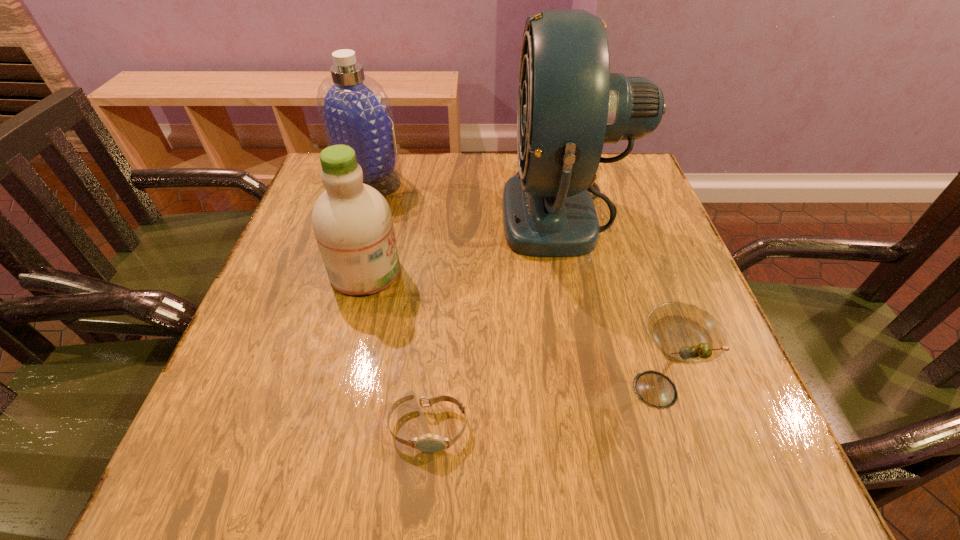
Locate an element on the screen. free space between the nearer cleansing agent and the third object from left to right is located at coordinates (396, 350).

Where is `blank region between the fan and the second shortest object`? Image resolution: width=960 pixels, height=540 pixels. blank region between the fan and the second shortest object is located at coordinates (611, 300).

I want to click on empty location between the nearer cleansing agent and the third object from left to right, so click(x=396, y=350).

Where is `free point between the fan and the farther cleansing agent`? free point between the fan and the farther cleansing agent is located at coordinates (468, 195).

I want to click on free space between the martini and the third object from right to left, so click(x=541, y=408).

You are a GUI agent. You are given a task and a screenshot of the screen. Output one action in this format:
    pyautogui.click(x=<x>, y=<y>)
    Task: Click on the free point between the nearer cleansing agent and the tallest object
    The image size is (960, 540).
    Given the screenshot: What is the action you would take?
    pyautogui.click(x=466, y=241)

This screenshot has width=960, height=540. What are the coordinates of `object that stands as the closest to the farther cleansing agent` in the screenshot? It's located at (352, 222).

This screenshot has height=540, width=960. Identify the location of the third closest object to the farther cleansing agent. (431, 443).

At what (x,y) coordinates should I click in order to perform the action: click on blank space that satisfies the following two spatial constraints: 1. in front of the fan to blow air; 2. on the right side of the martini. Please return your answer as a coordinate pair (x, y). Looking at the image, I should click on (605, 389).

Locate an element on the screen. free spot that satisfies the following two spatial constraints: 1. in front of the tallest object to blow air; 2. on the face of the watch is located at coordinates (612, 428).